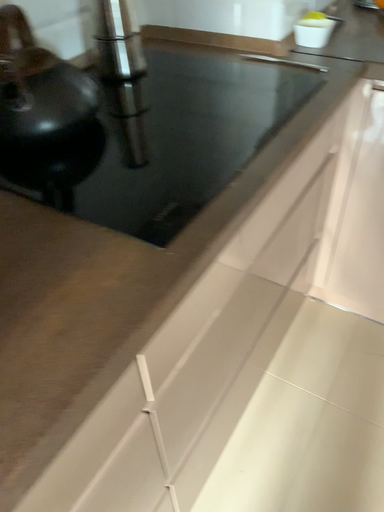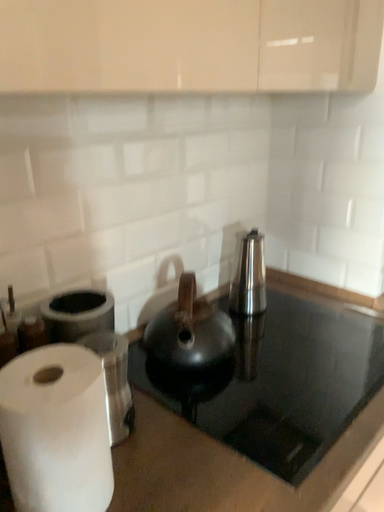
Question: Which way did the camera rotate in the video?

Choices:
 (A) rotated right
 (B) rotated left

Answer: (B)